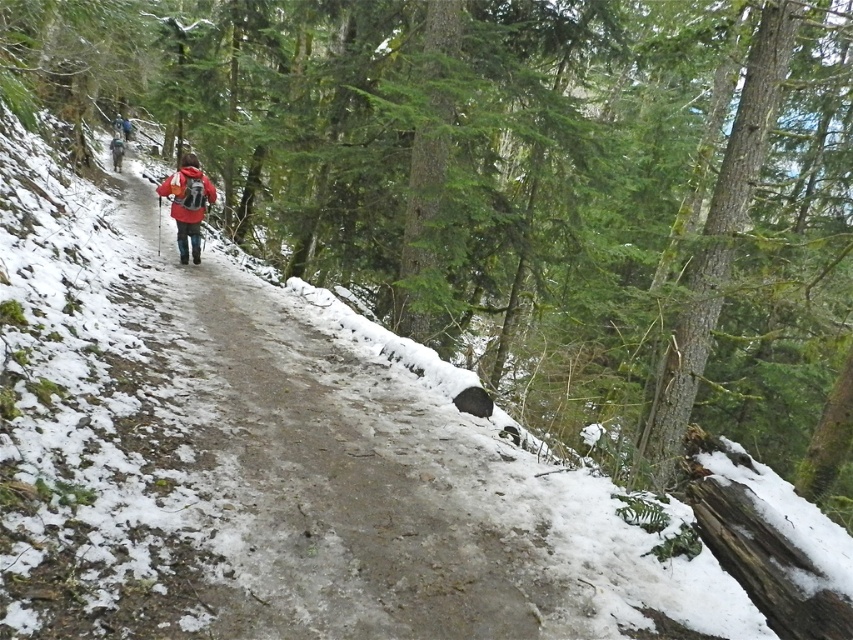
Question: Which of the following is the farthest from the observer?

Choices:
 (A) (113, 170)
 (B) (189, 154)

Answer: (A)

Question: Can you confirm if matte red jacket at center is wider than red jacket at center?

Choices:
 (A) no
 (B) yes

Answer: (A)

Question: Can you confirm if matte red jacket at center is positioned below red jacket at center?

Choices:
 (A) yes
 (B) no

Answer: (A)

Question: Which point is farther from the camera taking this photo?

Choices:
 (A) (117, 166)
 (B) (196, 227)

Answer: (A)

Question: Is matte red jacket at center wider than red jacket at center?

Choices:
 (A) yes
 (B) no

Answer: (B)

Question: Which point appears farthest from the camera in this image?

Choices:
 (A) (x=204, y=192)
 (B) (x=119, y=161)

Answer: (B)